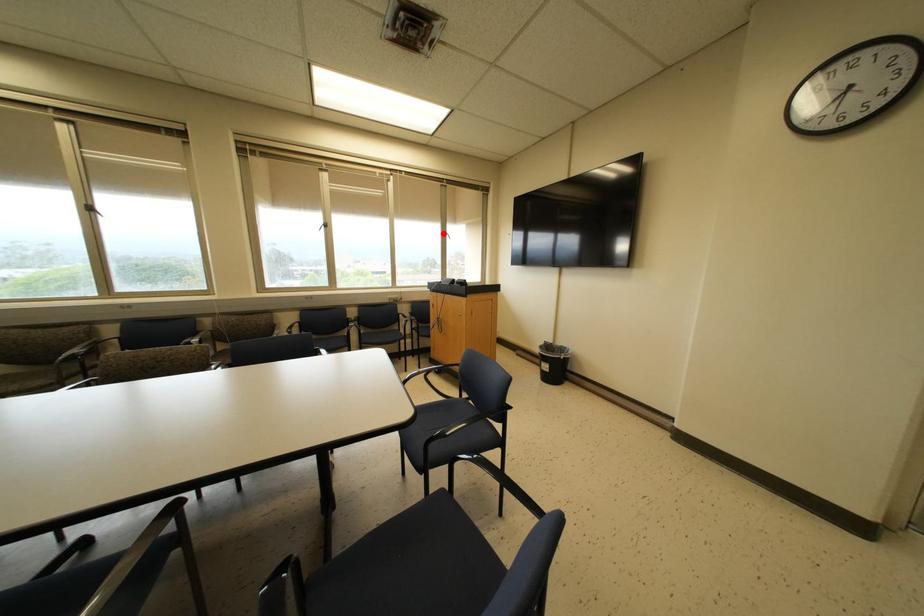
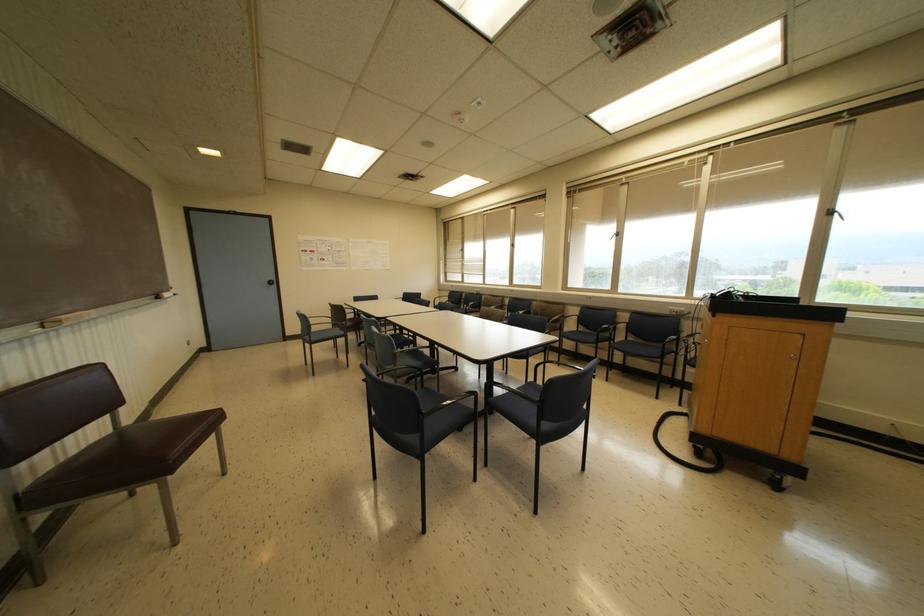
In the second image, find the point that corresponds to the highlighted location in the first image.

(827, 213)